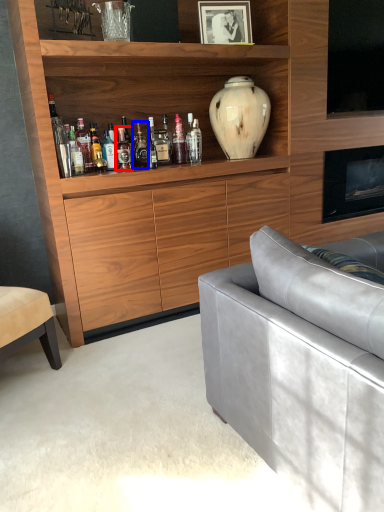
Question: Which object is closer to the camera taking this photo, bottle (highlighted by a red box) or bottle (highlighted by a blue box)?

Choices:
 (A) bottle
 (B) bottle

Answer: (A)